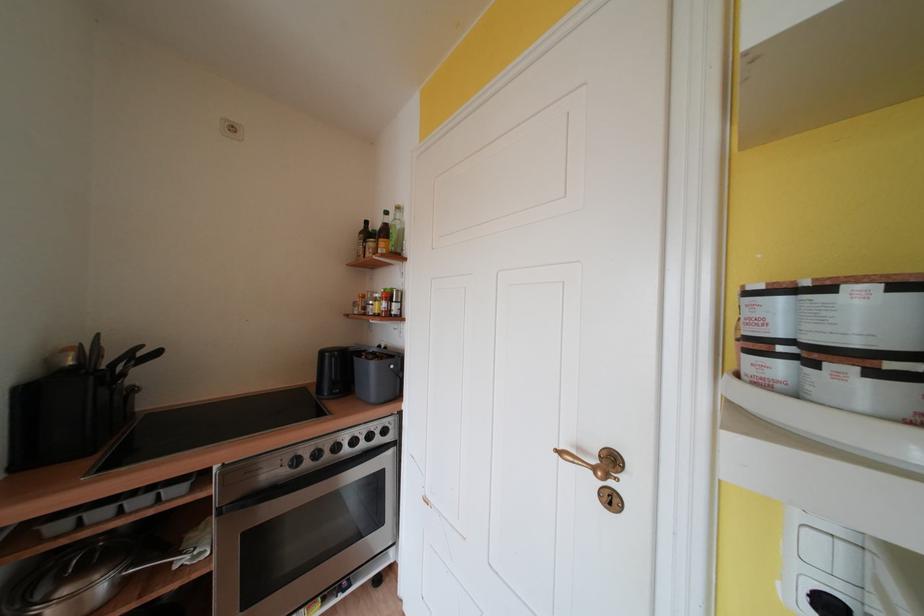
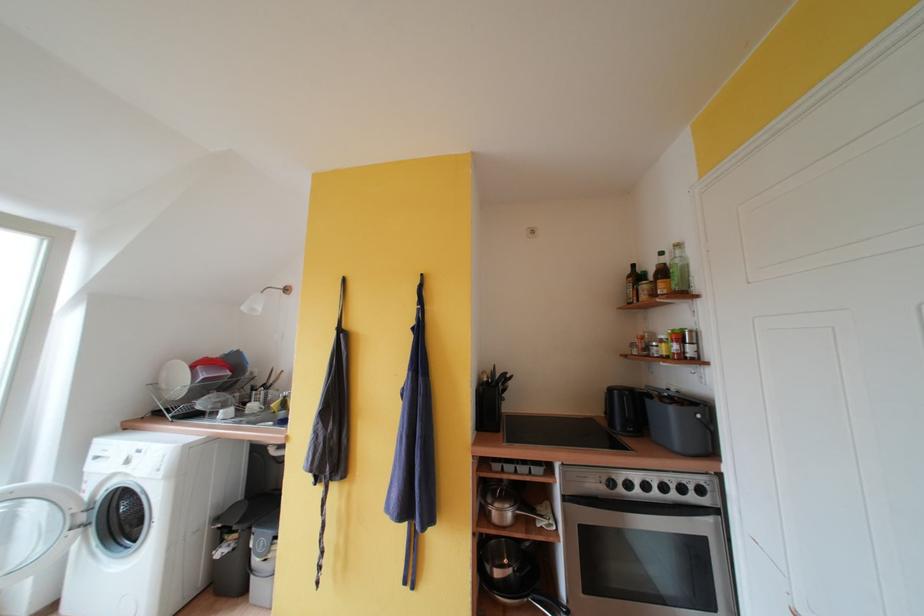
Where in the second image is the point corresponding to (297,469) from the first image?

(614, 490)